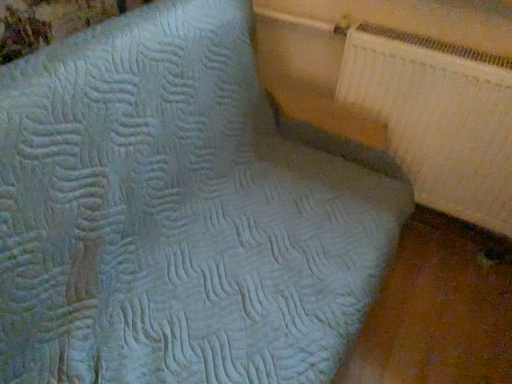
Locate an element on the screen. This screenshot has width=512, height=384. white textured radiator at right is located at coordinates (438, 118).

What is the approximate width of white textured radiator at right?

The width of white textured radiator at right is 4.55 inches.

The height and width of the screenshot is (384, 512). What do you see at coordinates (438, 118) in the screenshot?
I see `white textured radiator at right` at bounding box center [438, 118].

Identify the location of white textured radiator at right. This screenshot has height=384, width=512. (438, 118).